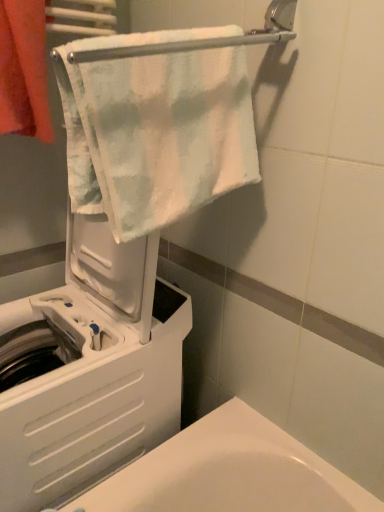
Question: Considering the positions of white plastic washing machine at left and orange cotton towel at upper left, marked as the second towel in a right-to-left arrangement, in the image, is white plastic washing machine at left wider or thinner than orange cotton towel at upper left, marked as the second towel in a right-to-left arrangement,?

Choices:
 (A) wide
 (B) thin

Answer: (A)

Question: Is white plastic washing machine at left inside the boundaries of orange cotton towel at upper left, marked as the second towel in a right-to-left arrangement, or outside?

Choices:
 (A) outside
 (B) inside

Answer: (A)

Question: Estimate the real-world distances between objects in this image. Which object is farther from the orange cotton towel at upper left, marked as the second towel in a right-to-left arrangement?

Choices:
 (A) white soft towel at upper center, placed as the second towel when sorted from left to right
 (B) white plastic washing machine at left

Answer: (B)

Question: Which object is positioned closest to the white soft towel at upper center, placed as the second towel when sorted from left to right?

Choices:
 (A) orange cotton towel at upper left, positioned as the 1th towel in left-to-right order
 (B) white plastic washing machine at left

Answer: (A)